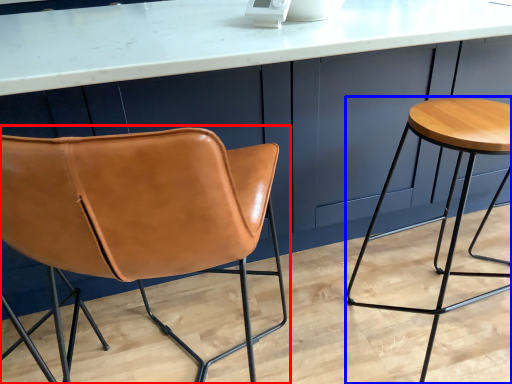
Question: Which point is further to the camera, chair (highlighted by a red box) or stool (highlighted by a blue box)?

Choices:
 (A) chair
 (B) stool

Answer: (B)